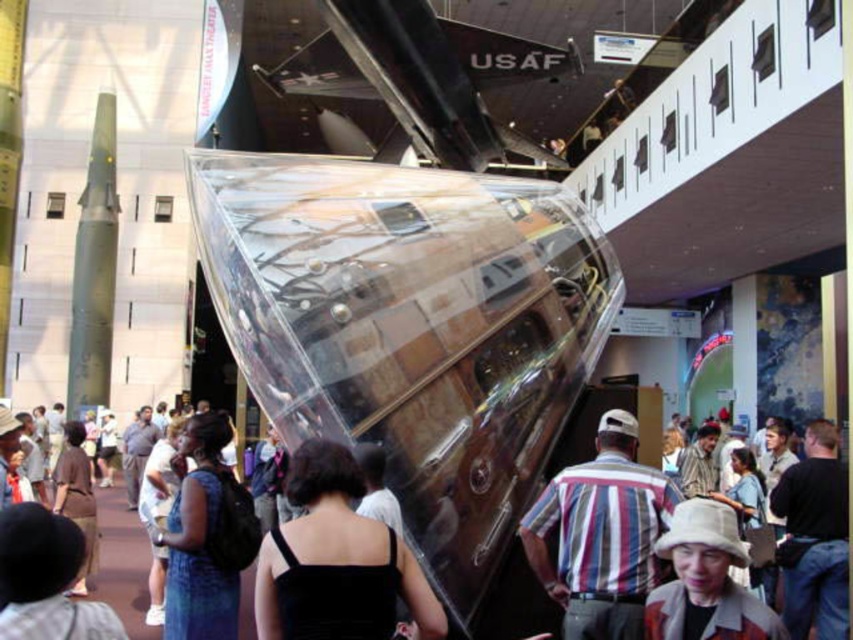
Who is higher up, black fabric dress at center or striped cotton shirt at center?

black fabric dress at center is above.

Can you confirm if black fabric dress at center is shorter than striped cotton shirt at center?

Incorrect, black fabric dress at center's height does not fall short of striped cotton shirt at center's.

Is point (326, 540) farther from viewer compared to point (540, 552)?

No, it is not.

What are the coordinates of `black fabric dress at center` in the screenshot? It's located at (335, 561).